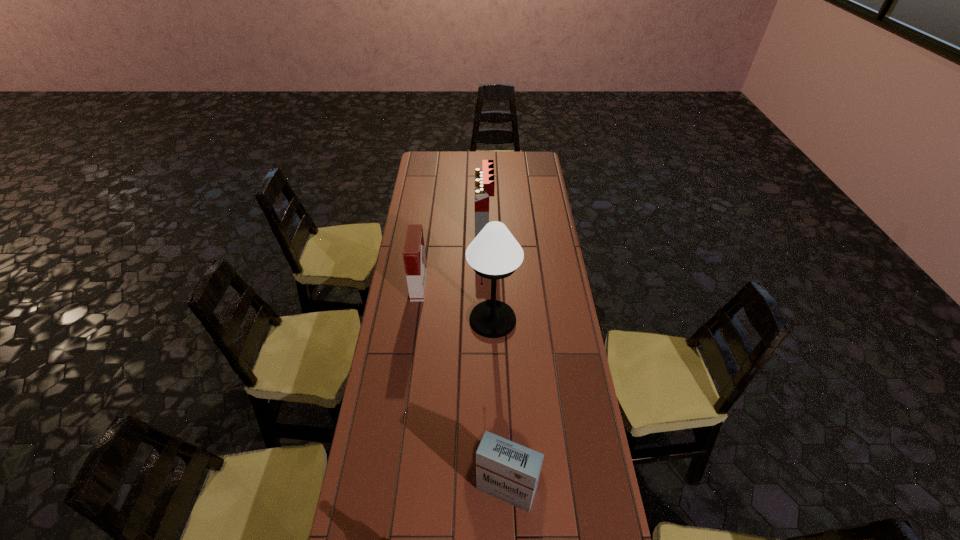
Where is `table lamp`? Image resolution: width=960 pixels, height=540 pixels. table lamp is located at coordinates (494, 254).

You are a GUI agent. You are given a task and a screenshot of the screen. Output one action in this format:
    pyautogui.click(x=<x>, y=<y>)
    Task: Click on the farthest object
    
    Given the screenshot: What is the action you would take?
    pyautogui.click(x=484, y=179)

Identify the location of the fourth shortest object. point(484,179).

The height and width of the screenshot is (540, 960). I want to click on the leftmost cigarette case, so click(414, 257).

Find the location of a particular element. the second nearest object is located at coordinates (506, 470).

I want to click on blank space located 0.390m on the back of the table lamp, so click(491, 240).

At what (x,y) coordinates should I click in order to perform the action: click on vacant area located with the lid open on the farthest cigarette case. Please return your answer as a coordinate pair (x, y). The image size is (960, 540). Looking at the image, I should click on (433, 227).

The image size is (960, 540). What are the coordinates of `blank space located with the lid open on the farthest cigarette case` in the screenshot? It's located at (410, 227).

The height and width of the screenshot is (540, 960). What are the coordinates of `free location located with the lid open on the farthest cigarette case` in the screenshot? It's located at click(x=463, y=227).

The width and height of the screenshot is (960, 540). What are the coordinates of `vacant space located 0.240m on the front-facing side of the leftmost cigarette case` in the screenshot? It's located at (482, 286).